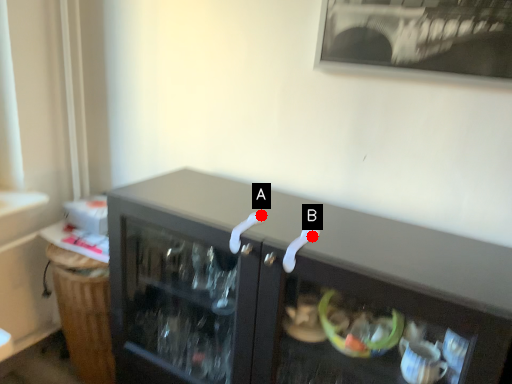
Question: Two points are circled on the image, labeled by A and B beside each circle. Which of the following is the closest to the observer?

Choices:
 (A) A is closer
 (B) B is closer

Answer: (B)